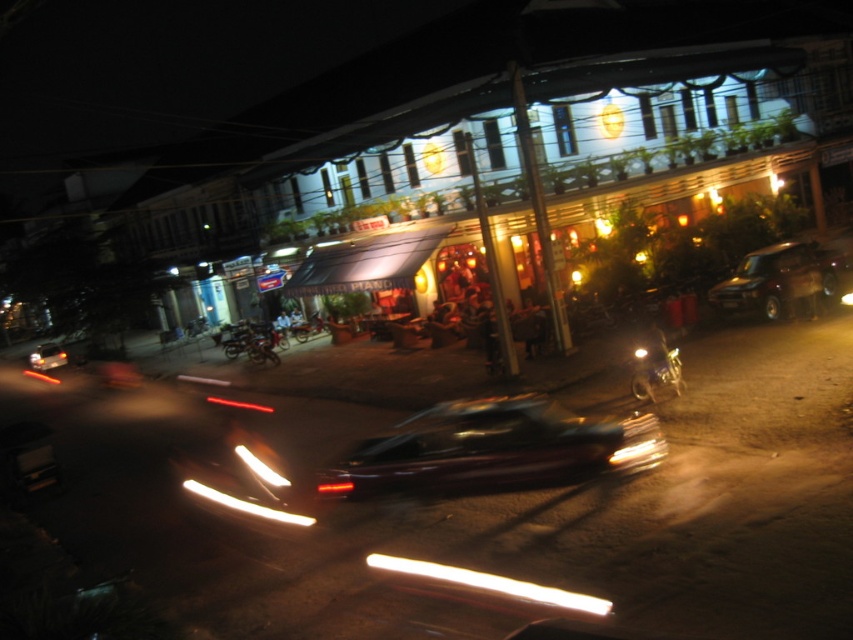
Looking at this image, is dark matte van at right bigger than white fluorescent tube at center?

Correct, dark matte van at right is larger in size than white fluorescent tube at center.

Which is in front, point (785, 289) or point (473, 588)?

Point (473, 588)

Locate an element on the screen. The height and width of the screenshot is (640, 853). dark matte van at right is located at coordinates (775, 280).

Which of these two, metallic silver motorcycle at center-right or shiny chrome motorcycle at center-left, stands taller?

Standing taller between the two is shiny chrome motorcycle at center-left.

Does metallic silver motorcycle at center-right appear under shiny chrome motorcycle at center-left?

Correct, metallic silver motorcycle at center-right is located below shiny chrome motorcycle at center-left.

At what (x,y) coordinates should I click in order to perform the action: click on metallic silver motorcycle at center-right. Please return your answer as a coordinate pair (x, y). Image resolution: width=853 pixels, height=640 pixels. Looking at the image, I should click on (654, 368).

Does dark matte van at right appear on the right side of shiny silver car at lower left?

Yes, dark matte van at right is to the right of shiny silver car at lower left.

Which is more to the right, dark matte van at right or shiny silver car at lower left?

dark matte van at right

In order to click on dark matte van at right in this screenshot , I will do `click(775, 280)`.